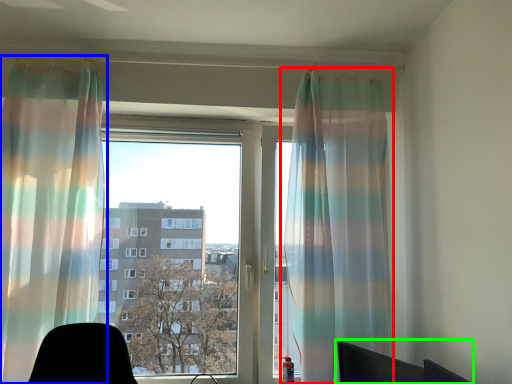
Question: Which is nearer to the curtain (highlighted by a red box)? curtain (highlighted by a blue box) or computer chair (highlighted by a green box).

Choices:
 (A) curtain
 (B) computer chair

Answer: (B)